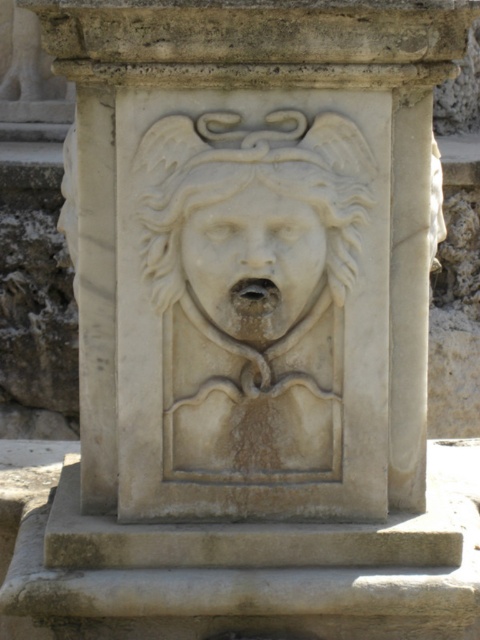
Question: Which of the following is the closest to the observer?

Choices:
 (A) (320, 198)
 (B) (295, 282)

Answer: (A)

Question: Does white marble lion at center have a lesser width compared to white marble face at center?

Choices:
 (A) no
 (B) yes

Answer: (A)

Question: Does white marble lion at center have a smaller size compared to white marble face at center?

Choices:
 (A) no
 (B) yes

Answer: (A)

Question: Which object is closer to the camera taking this photo?

Choices:
 (A) white marble lion at center
 (B) white marble face at center

Answer: (A)

Question: In this image, where is white marble lion at center located relative to white marble face at center?

Choices:
 (A) below
 (B) above

Answer: (B)